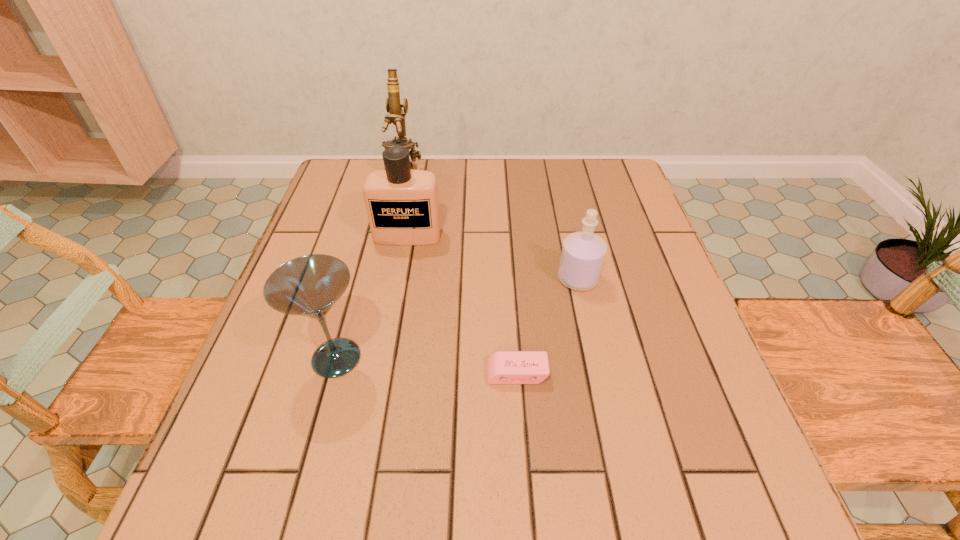
Find the location of `the farthest object`. the farthest object is located at coordinates (397, 116).

I want to click on the tallest object, so click(x=397, y=116).

At what (x,y) coordinates should I click in order to perform the action: click on the farther perfume. Please return your answer as a coordinate pair (x, y). Image resolution: width=960 pixels, height=540 pixels. Looking at the image, I should click on (402, 205).

Locate an element on the screen. This screenshot has width=960, height=540. the fourth nearest object is located at coordinates (402, 205).

At what (x,y) coordinates should I click in order to perform the action: click on martini. Please return your answer as a coordinate pair (x, y). Looking at the image, I should click on (309, 286).

Where is `the nearer perfume`? The height and width of the screenshot is (540, 960). the nearer perfume is located at coordinates (583, 253).

Find the location of a particular element. This screenshot has width=960, height=540. the rightmost object is located at coordinates (583, 253).

The height and width of the screenshot is (540, 960). In order to click on eraser in this screenshot , I will do `click(503, 367)`.

Find the location of a particular element. The height and width of the screenshot is (540, 960). the fourth object from left to right is located at coordinates (503, 367).

Where is `free region located 0.130m on the front of the farthest object`? This screenshot has width=960, height=540. free region located 0.130m on the front of the farthest object is located at coordinates (396, 214).